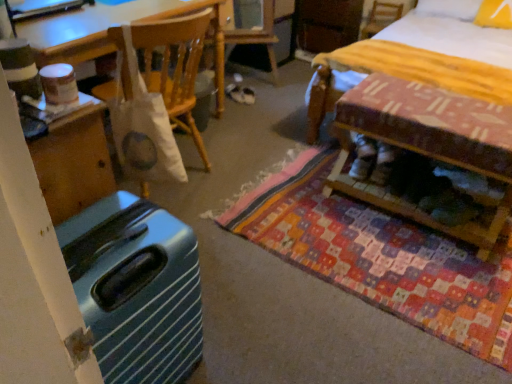
Question: From their relative heights in the image, would you say white suede shoes at center is taller or shorter than yellow fabric pillow at upper right?

Choices:
 (A) tall
 (B) short

Answer: (B)

Question: Considering the positions of point (362, 175) and point (487, 11), is point (362, 175) closer or farther from the camera than point (487, 11)?

Choices:
 (A) closer
 (B) farther

Answer: (A)

Question: Considering the real-world distances, which object is farthest from the teal glossy suitcase at lower left?

Choices:
 (A) yellow fabric pillow at upper right
 (B) patchwork fabric mat at center
 (C) wooden bench at lower right
 (D) wooden chair at upper right
 (E) white fabric bag at upper center

Answer: (D)

Question: Estimate the real-world distances between objects in this image. Which object is closer to the yellow fabric pillow at upper right?

Choices:
 (A) teal glossy suitcase at lower left
 (B) wooden chair at upper right
 (C) white suede shoes at center
 (D) white fabric bag at upper center
 (E) wooden bench at lower right

Answer: (B)